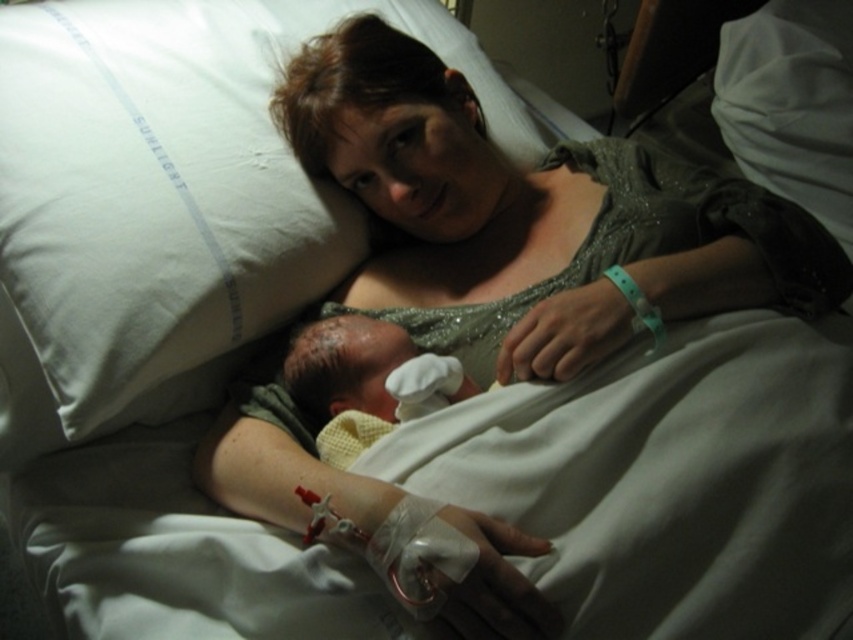
Question: Is white soft pillow at upper left thinner than yellow textured blanket at center?

Choices:
 (A) yes
 (B) no

Answer: (B)

Question: Can you confirm if white soft pillow at upper left is smaller than yellow textured blanket at center?

Choices:
 (A) yes
 (B) no

Answer: (B)

Question: In this image, where is white soft pillow at upper left located relative to yellow textured blanket at center?

Choices:
 (A) above
 (B) below

Answer: (A)

Question: Which object is farther from the camera taking this photo?

Choices:
 (A) yellow textured blanket at center
 (B) white soft pillow at upper left

Answer: (A)

Question: Which object appears closest to the camera in this image?

Choices:
 (A) white soft pillow at upper left
 (B) yellow textured blanket at center

Answer: (A)